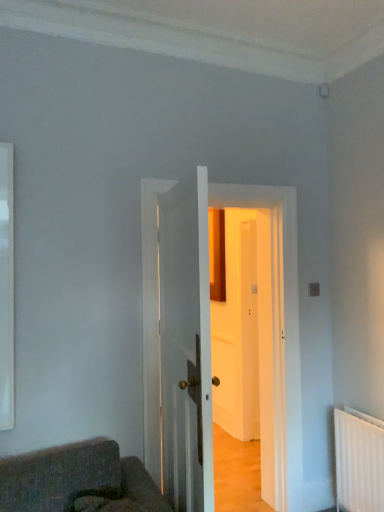
Question: Is white wooden door at center, placed as the first door when sorted from back to front, wider than white glossy door at center, the first door when ordered from front to back?

Choices:
 (A) yes
 (B) no

Answer: (A)

Question: From a real-world perspective, is white wooden door at center, the 2th door from the front, positioned under white glossy door at center, the 2th door in the back-to-front sequence, based on gravity?

Choices:
 (A) yes
 (B) no

Answer: (A)

Question: From the image's perspective, does white wooden door at center, the 2th door from the front, appear higher than white glossy door at center, the 2th door in the back-to-front sequence?

Choices:
 (A) no
 (B) yes

Answer: (A)

Question: Is white wooden door at center, placed as the first door when sorted from back to front, oriented away from white glossy door at center, the 2th door in the back-to-front sequence?

Choices:
 (A) yes
 (B) no

Answer: (B)

Question: Does white wooden door at center, the 2th door from the front, have a greater height compared to white glossy door at center, the first door when ordered from front to back?

Choices:
 (A) no
 (B) yes

Answer: (B)

Question: Is white wooden door at center, placed as the first door when sorted from back to front, aimed at white glossy door at center, the first door when ordered from front to back?

Choices:
 (A) yes
 (B) no

Answer: (A)

Question: Can you confirm if white glossy door at center, the first door when ordered from front to back, is bigger than white glossy window at left?

Choices:
 (A) yes
 (B) no

Answer: (A)

Question: Is white glossy door at center, the first door when ordered from front to back, completely or partially outside of white glossy window at left?

Choices:
 (A) no
 (B) yes

Answer: (B)

Question: Does white glossy door at center, the 2th door in the back-to-front sequence, have a greater height compared to white glossy window at left?

Choices:
 (A) yes
 (B) no

Answer: (A)

Question: Considering the relative sizes of white glossy door at center, the 2th door in the back-to-front sequence, and white glossy window at left in the image provided, is white glossy door at center, the 2th door in the back-to-front sequence, shorter than white glossy window at left?

Choices:
 (A) yes
 (B) no

Answer: (B)

Question: Is white glossy window at left inside white glossy door at center, the first door when ordered from front to back?

Choices:
 (A) yes
 (B) no

Answer: (B)

Question: Considering the relative sizes of white glossy door at center, the 2th door in the back-to-front sequence, and white glossy window at left in the image provided, is white glossy door at center, the 2th door in the back-to-front sequence, wider than white glossy window at left?

Choices:
 (A) no
 (B) yes

Answer: (B)

Question: Considering the relative sizes of white glossy window at left and white glossy door at center, the 2th door in the back-to-front sequence, in the image provided, is white glossy window at left smaller than white glossy door at center, the 2th door in the back-to-front sequence,?

Choices:
 (A) no
 (B) yes

Answer: (B)